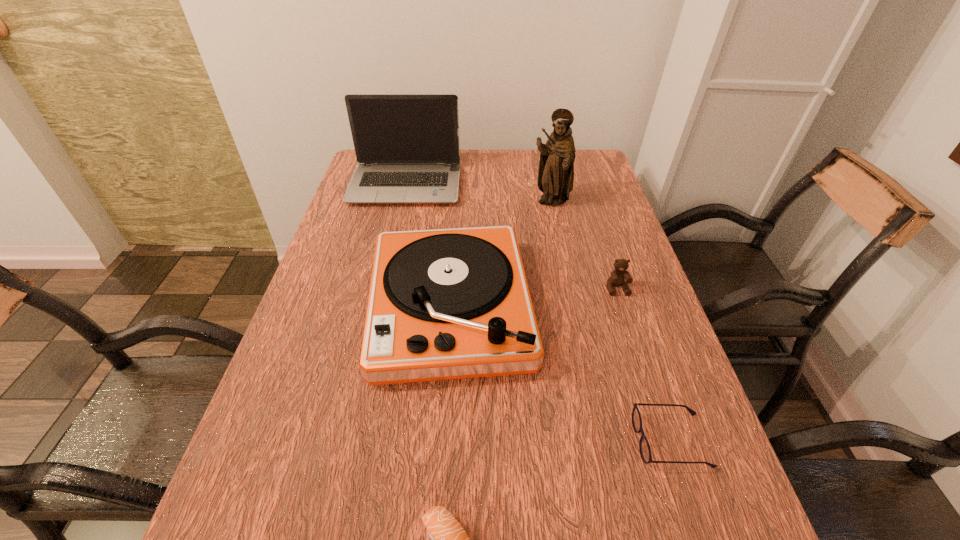
Locate an element on the screen. vacant area located 0.170m on the front-facing side of the spectacles is located at coordinates (542, 441).

Identify the location of vacant area situated on the front-facing side of the spectacles. (432, 441).

Identify the location of object present at the far edge. The width and height of the screenshot is (960, 540). (407, 147).

This screenshot has width=960, height=540. I want to click on laptop computer at the left edge, so click(x=407, y=147).

I want to click on record player at the left edge, so click(x=443, y=304).

Where is `figurine at the right edge`? Image resolution: width=960 pixels, height=540 pixels. figurine at the right edge is located at coordinates (556, 165).

Identify the location of teddy bear that is positioned at the right edge. [619, 277].

Find the location of a particular element. spectacles situated at the right edge is located at coordinates (644, 447).

This screenshot has height=540, width=960. Find the location of `object that is at the far left corner`. object that is at the far left corner is located at coordinates (407, 147).

I want to click on vacant area at the far edge, so pyautogui.click(x=499, y=179).